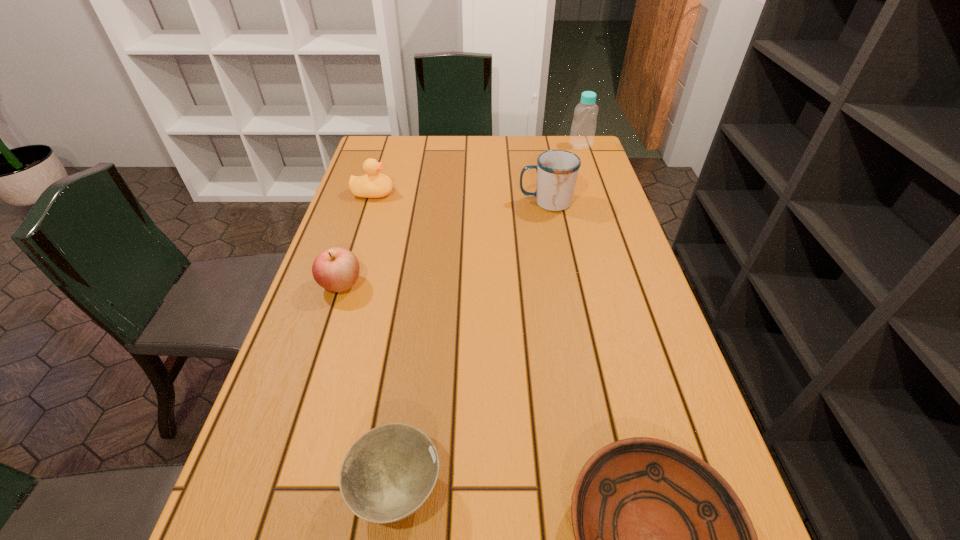
This screenshot has width=960, height=540. I want to click on vacant space at the far right corner of the desktop, so click(594, 150).

Find the location of a particular element. The height and width of the screenshot is (540, 960). free spot between the duck and the bottle is located at coordinates (477, 170).

You are a GUI agent. You are given a task and a screenshot of the screen. Output one action in this format:
    pyautogui.click(x=<x>, y=<y>)
    Task: Click on the vacant point located between the apple and the duck
    Image resolution: width=960 pixels, height=540 pixels.
    Given the screenshot: What is the action you would take?
    pyautogui.click(x=357, y=239)

Identify which object is the fourth closest to the duck. Please provide its 2D coordinates. Your answer should be formatted as a tuple, i.e. [(x, y)], where the tuple contains the x and y coordinates of a point satisfying the conditions above.

[(389, 472)]

Select which object is the closest to the tallest object. Please provide its 2D coordinates. Your answer should be formatted as a tuple, i.e. [(x, y)], where the tuple contains the x and y coordinates of a point satisfying the conditions above.

[(557, 170)]

This screenshot has height=540, width=960. I want to click on vacant space that satisfies the following two spatial constraints: 1. on the handle side of the mug; 2. on the front side of the third nearest object, so click(562, 284).